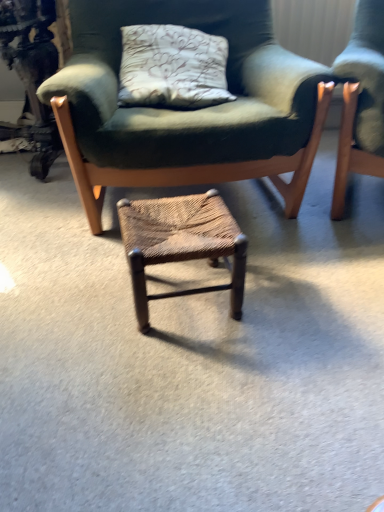
Describe the element at coordinates (189, 110) in the screenshot. I see `green fabric chair at center` at that location.

Where is `green fabric chair at center`? green fabric chair at center is located at coordinates (189, 110).

Identify the location of woven brown stool at center. (181, 243).

Describe the element at coordinates (181, 243) in the screenshot. I see `woven brown stool at center` at that location.

Locate an element on the screen. The width and height of the screenshot is (384, 512). green fabric chair at center is located at coordinates (189, 110).

Which is more to the left, green fabric chair at center or woven brown stool at center?

Positioned to the left is green fabric chair at center.

Which object is closer to the camera, green fabric chair at center or woven brown stool at center?

woven brown stool at center.

Considering the positions of point (174, 130) and point (209, 287), is point (174, 130) closer or farther from the camera than point (209, 287)?

Point (174, 130) is positioned farther from the camera compared to point (209, 287).

From the image's perspective, relative to woven brown stool at center, is green fabric chair at center above or below?

From the image's perspective, green fabric chair at center appears above woven brown stool at center.

From the picture: From a real-world perspective, is green fabric chair at center on woven brown stool at center?

Correct, in the physical world, green fabric chair at center is higher than woven brown stool at center.

Considering the sizes of green fabric chair at center and woven brown stool at center in the image, is green fabric chair at center wider or thinner than woven brown stool at center?

green fabric chair at center is wider than woven brown stool at center.

Is green fabric chair at center shorter than woven brown stool at center?

Incorrect, the height of green fabric chair at center does not fall short of that of woven brown stool at center.

Which of these two, green fabric chair at center or woven brown stool at center, is smaller?

Smaller between the two is woven brown stool at center.

Is green fabric chair at center surrounding woven brown stool at center?

That's incorrect, woven brown stool at center is not inside green fabric chair at center.

Is green fabric chair at center directly adjacent to woven brown stool at center?

No, green fabric chair at center is not making contact with woven brown stool at center.

Is green fabric chair at center looking in the opposite direction of woven brown stool at center?

No, green fabric chair at center is not facing the opposite direction of woven brown stool at center.

Can you tell me how much green fabric chair at center and woven brown stool at center differ in facing direction?

The facing directions of green fabric chair at center and woven brown stool at center are 3.77 degrees apart.

Consider the image. How distant is green fabric chair at center from woven brown stool at center?

15.47 inches.

In the image, there is a green fabric chair at center. Find the location of `stool below it (from the image's perspective)`. stool below it (from the image's perspective) is located at coordinates (181, 243).

Can you confirm if woven brown stool at center is positioned to the right of green fabric chair at center?

Yes.

Considering the relative positions of woven brown stool at center and green fabric chair at center in the image provided, is woven brown stool at center behind green fabric chair at center?

No, the depth of woven brown stool at center is less than that of green fabric chair at center.

Is point (142, 268) farther from camera compared to point (60, 124)?

No, (142, 268) is closer to viewer.

Based on the photo, from the image's perspective, is woven brown stool at center above or below green fabric chair at center?

woven brown stool at center is situated lower than green fabric chair at center in the image.

From a real-world perspective, is woven brown stool at center located higher than green fabric chair at center?

Actually, woven brown stool at center is physically below green fabric chair at center in the real world.

Can you confirm if woven brown stool at center is thinner than green fabric chair at center?

Indeed, woven brown stool at center has a lesser width compared to green fabric chair at center.

Is woven brown stool at center taller or shorter than green fabric chair at center?

Clearly, woven brown stool at center is shorter compared to green fabric chair at center.

Which of these two, woven brown stool at center or green fabric chair at center, is bigger?

green fabric chair at center.

Can green fabric chair at center be found inside woven brown stool at center?

That's incorrect, green fabric chair at center is not inside woven brown stool at center.

Are woven brown stool at center and green fabric chair at center far apart?

woven brown stool at center is near green fabric chair at center, not far away.

Is woven brown stool at center oriented away from green fabric chair at center?

Yes.

Can you tell me how much woven brown stool at center and green fabric chair at center differ in facing direction?

The facing directions of woven brown stool at center and green fabric chair at center are 3.77 degrees apart.

How much distance is there between woven brown stool at center and green fabric chair at center?

woven brown stool at center is 15.47 inches from green fabric chair at center.

Find the location of `stool located in front of the green fabric chair at center`. stool located in front of the green fabric chair at center is located at coordinates (181, 243).

Where is `stool that is in front of the green fabric chair at center`? stool that is in front of the green fabric chair at center is located at coordinates (181, 243).

Find the location of `chair that is behind the woven brown stool at center`. chair that is behind the woven brown stool at center is located at coordinates (189, 110).